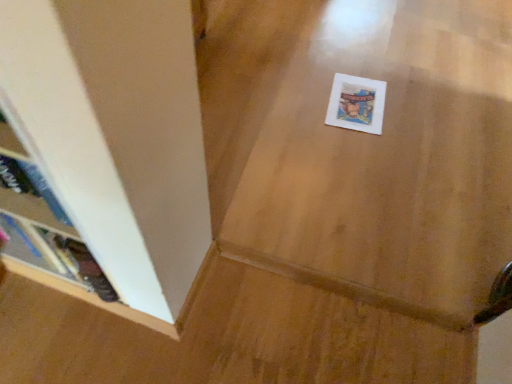
The image size is (512, 384). I want to click on vacant space behind white paper postcard at center, so click(x=355, y=63).